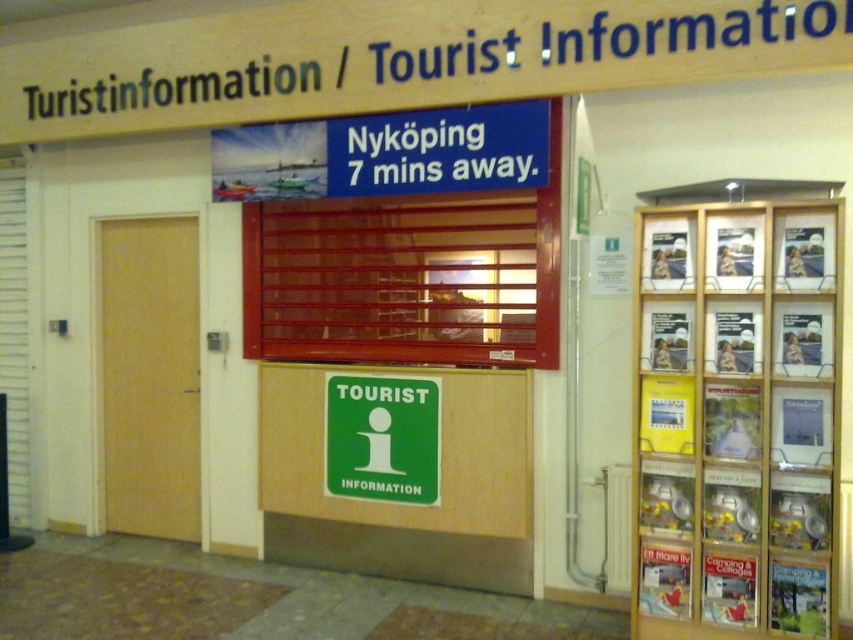
Question: Among these points, which one is nearest to the camera?

Choices:
 (A) (120, 240)
 (B) (431, 442)

Answer: (B)

Question: Among these objects, which one is nearest to the camera?

Choices:
 (A) green matte sign at center
 (B) wooden frame brochure rack at right

Answer: (B)

Question: Can you confirm if wooden frame brochure rack at right is positioned above wooden door at left?

Choices:
 (A) yes
 (B) no

Answer: (B)

Question: Is wooden door at left thinner than green matte sign at center?

Choices:
 (A) no
 (B) yes

Answer: (A)

Question: Is wooden frame brochure rack at right to the right of wooden door at left from the viewer's perspective?

Choices:
 (A) no
 (B) yes

Answer: (B)

Question: Which object is the farthest from the wooden frame brochure rack at right?

Choices:
 (A) wooden door at left
 (B) green matte sign at center

Answer: (A)